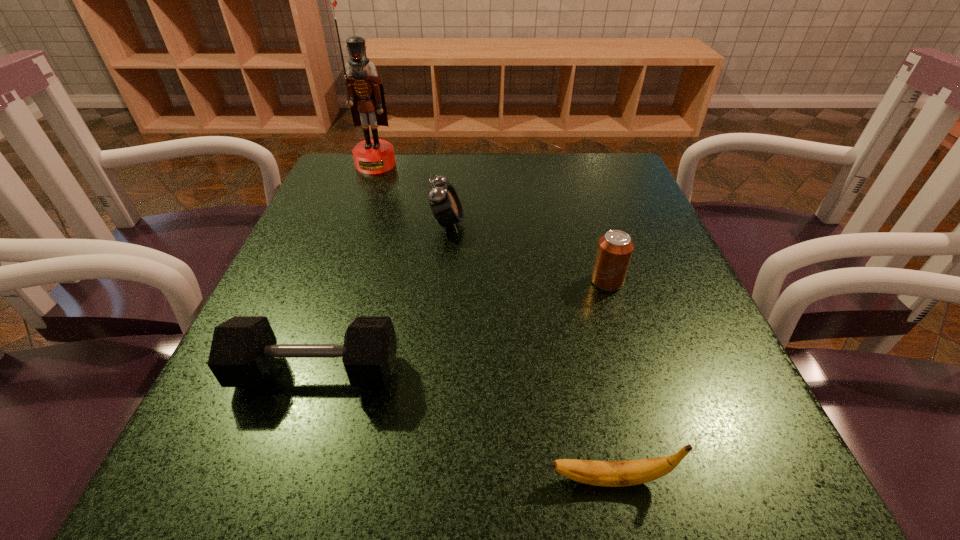
Where is `the tallest object`? the tallest object is located at coordinates (365, 95).

In order to click on the farthest object in this screenshot , I will do `click(365, 95)`.

In order to click on alarm clock in this screenshot , I will do (x=444, y=201).

This screenshot has height=540, width=960. In order to click on the third object from right to left in this screenshot , I will do click(x=444, y=201).

The image size is (960, 540). In order to click on can in this screenshot , I will do [615, 248].

The image size is (960, 540). In order to click on the fourth farthest object in this screenshot , I will do `click(243, 349)`.

This screenshot has width=960, height=540. Find the location of `the nearest object`. the nearest object is located at coordinates (633, 472).

Locate an element on the screen. the shortest object is located at coordinates (633, 472).

You are a GUI agent. You are given a task and a screenshot of the screen. Output one action in this format:
    pyautogui.click(x=<x>, y=<y>)
    Task: Click on the vacant region located on the front-facing side of the farthest object
    
    Given the screenshot: What is the action you would take?
    pos(368,187)

This screenshot has width=960, height=540. In order to click on vacant region located on the face of the fourth nearest object in this screenshot , I will do `click(546, 224)`.